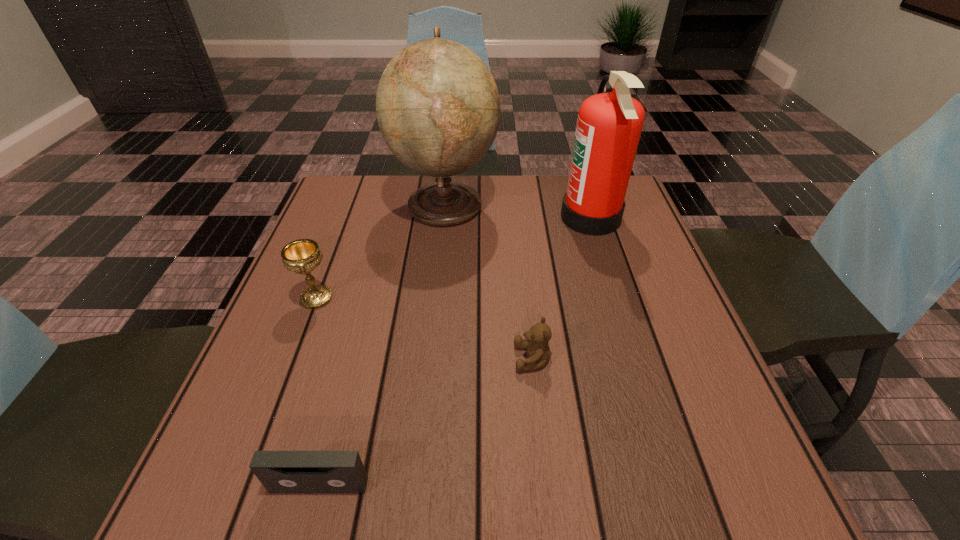
Locate an element on the screen. The width and height of the screenshot is (960, 540). vacant space that satisfies the following two spatial constraints: 1. on the front-facing side of the teddy bear; 2. on the front-facing side of the nearest object is located at coordinates (546, 485).

Find the location of `vacant position in the image that satisfies the following two spatial constraints: 1. at the nozzle of the fire extinguisher; 2. on the front-facing side of the videotape`. vacant position in the image that satisfies the following two spatial constraints: 1. at the nozzle of the fire extinguisher; 2. on the front-facing side of the videotape is located at coordinates (675, 485).